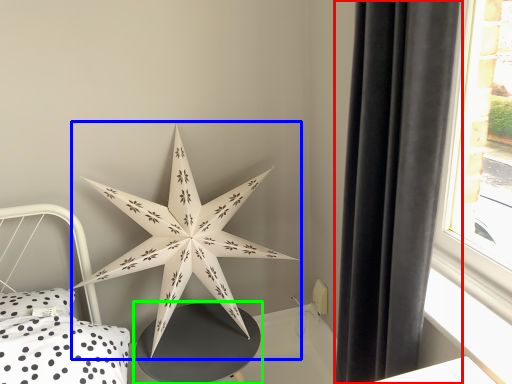
Question: Based on their relative distances, which object is farther from curtain (highlighted by a red box)? Choose from star (highlighted by a blue box) and table (highlighted by a green box).

Choices:
 (A) star
 (B) table

Answer: (B)